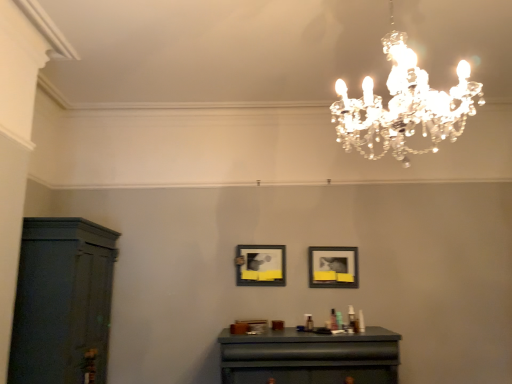
Question: From a real-world perspective, is matte black picture frame at center, placed as the first picture frame when sorted from left to right, physically located above or below dark wood cabinet at left?

Choices:
 (A) above
 (B) below

Answer: (A)

Question: Looking at their shapes, would you say matte black picture frame at center, the 2th picture frame in the right-to-left sequence, is wider or thinner than dark wood cabinet at left?

Choices:
 (A) wide
 (B) thin

Answer: (B)

Question: Which object is the farthest from the matte black picture frame at center, the 2th picture frame in the right-to-left sequence?

Choices:
 (A) matte black table at center
 (B) matte black picture frame at center, which is counted as the second picture frame, starting from the left
 (C) dark wood cabinet at left
 (D) clear crystal chandelier at upper center

Answer: (D)

Question: Which of these objects is positioned closest to the matte black picture frame at center, the 2th picture frame in the right-to-left sequence?

Choices:
 (A) clear crystal chandelier at upper center
 (B) matte black table at center
 (C) dark wood cabinet at left
 (D) matte black picture frame at center, the 1th picture frame viewed from the right

Answer: (D)